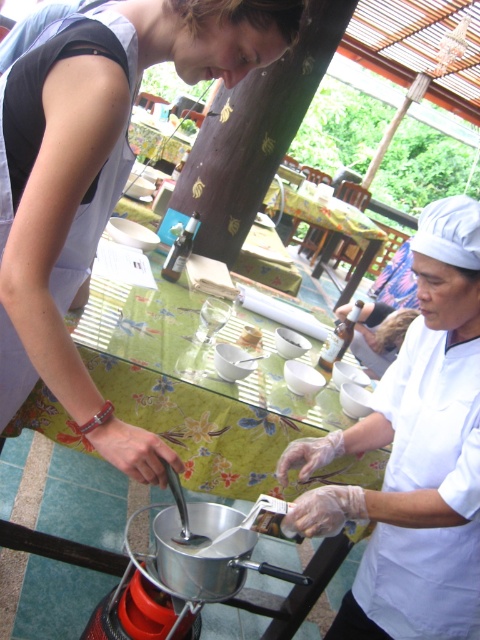
You are standing in the cooking workshop and need to place a decorative plate at the exact center of the scene. The coordinates of the scene are from 0 to 1 on both axes. Where is the matte white chef hat at upper right located relative to the center?

The matte white chef hat at upper right is located at coordinates (103, 172), which is to the left and below the center point of the scene.

You are standing in the scene and want to take a photo of the point at coordinates point (97, 163). Is this point within your camera frame?

The point (97, 163) is 34.01 inches from the camera, so it is within the camera frame.

You are setting up a display for a cooking class and need to arrange the white glossy chef hat at upper right and the white matte bowl at center. If you want to place them side by side on a shelf, which object should go first if the shelf is wider on the left side?

The white glossy chef hat at upper right should be placed first on the left side of the shelf because it is wider than the white matte bowl at center, ensuring it fits better in the wider area.